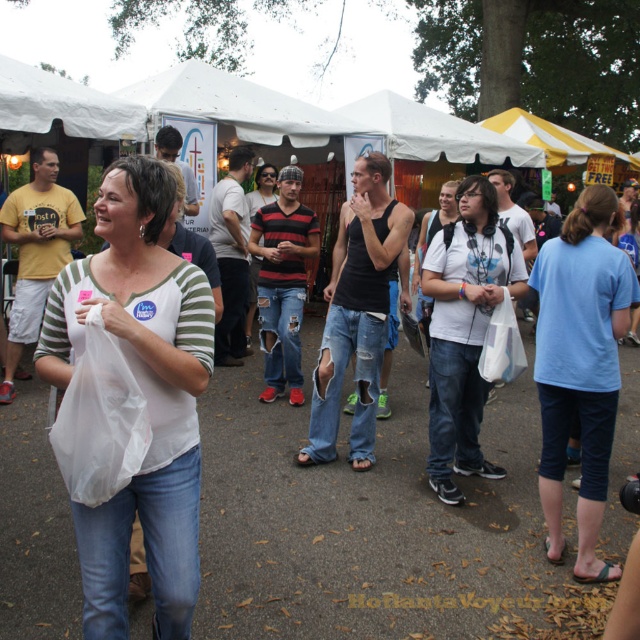
You are standing at the entrance of the tent and want to find the light blue cotton shirt at center. According to the coordinates provided, in which direction should you look?

The light blue cotton shirt at center is located at coordinates point (580, 365), so you should look towards the upper right direction from your current position at the entrance.